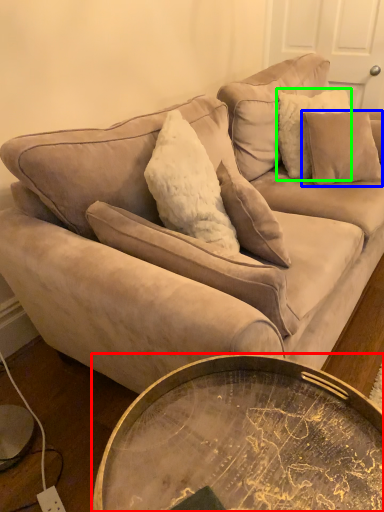
Question: Which object is positioned farthest from coffee table (highlighted by a red box)? Select from pillow (highlighted by a blue box) and pillow (highlighted by a green box).

Choices:
 (A) pillow
 (B) pillow

Answer: (B)